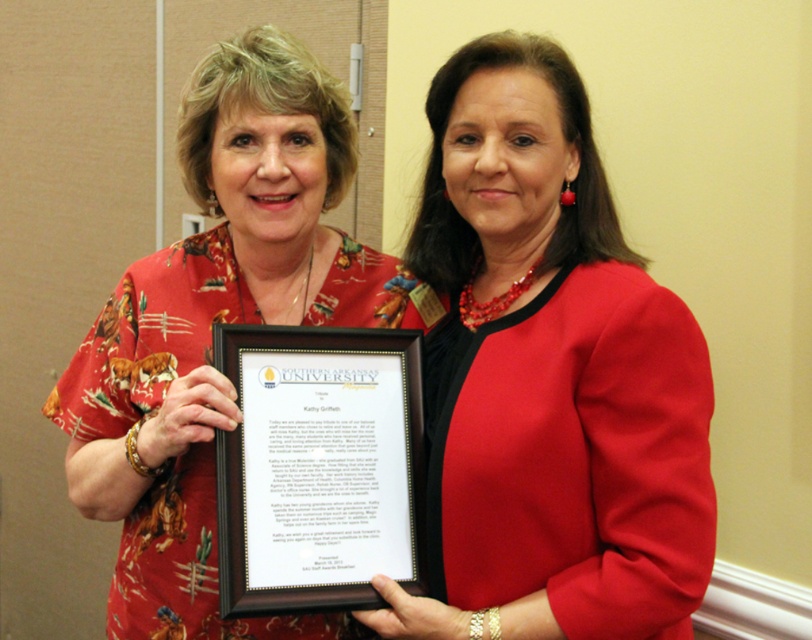
Question: Considering the real-world distances, which object is farthest from the floral fabric blouse at center?

Choices:
 (A) matte red blazer at center
 (B) black wood framed certificate at center

Answer: (A)

Question: Does matte red blazer at center have a larger size compared to floral fabric blouse at center?

Choices:
 (A) no
 (B) yes

Answer: (A)

Question: From the image, what is the correct spatial relationship of matte red blazer at center in relation to black wood framed certificate at center?

Choices:
 (A) left
 (B) right

Answer: (B)

Question: Which of the following is the farthest from the observer?

Choices:
 (A) floral fabric blouse at center
 (B) black wood framed certificate at center

Answer: (A)

Question: Which object appears farthest from the camera in this image?

Choices:
 (A) matte red blazer at center
 (B) black wood framed certificate at center

Answer: (B)

Question: Can you confirm if matte red blazer at center is thinner than floral fabric blouse at center?

Choices:
 (A) yes
 (B) no

Answer: (A)